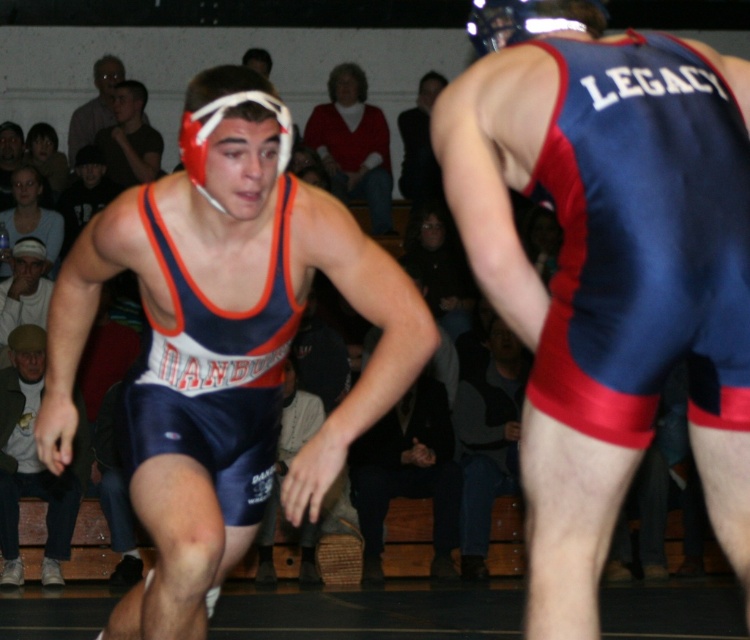
Does matte blue singlet at lower left appear on the left side of matte red sweater at center?

Indeed, matte blue singlet at lower left is positioned on the left side of matte red sweater at center.

Is matte blue singlet at lower left wider than matte red sweater at center?

In fact, matte blue singlet at lower left might be narrower than matte red sweater at center.

Which is in front, point (18, 337) or point (363, 109)?

Point (18, 337) is more forward.

I want to click on matte blue singlet at lower left, so click(30, 464).

Measure the distance between blue fabric singlet at center and white cotton cap at lower left.

A distance of 12.50 feet exists between blue fabric singlet at center and white cotton cap at lower left.

Is blue fabric singlet at center behind white cotton cap at lower left?

No, blue fabric singlet at center is closer to the viewer.

Who is more forward, (288,445) or (30,284)?

Point (288,445)

What are the coordinates of `blue fabric singlet at center` in the screenshot? It's located at (285, 461).

Is matte blue singlet at lower left taller than matte black headgear at upper left?

Correct, matte blue singlet at lower left is much taller as matte black headgear at upper left.

Does matte blue singlet at lower left appear on the left side of matte black headgear at upper left?

In fact, matte blue singlet at lower left is to the right of matte black headgear at upper left.

Image resolution: width=750 pixels, height=640 pixels. What are the coordinates of `matte blue singlet at lower left` in the screenshot? It's located at (30, 464).

Locate an element on the screen. The width and height of the screenshot is (750, 640). matte blue singlet at lower left is located at coordinates (30, 464).